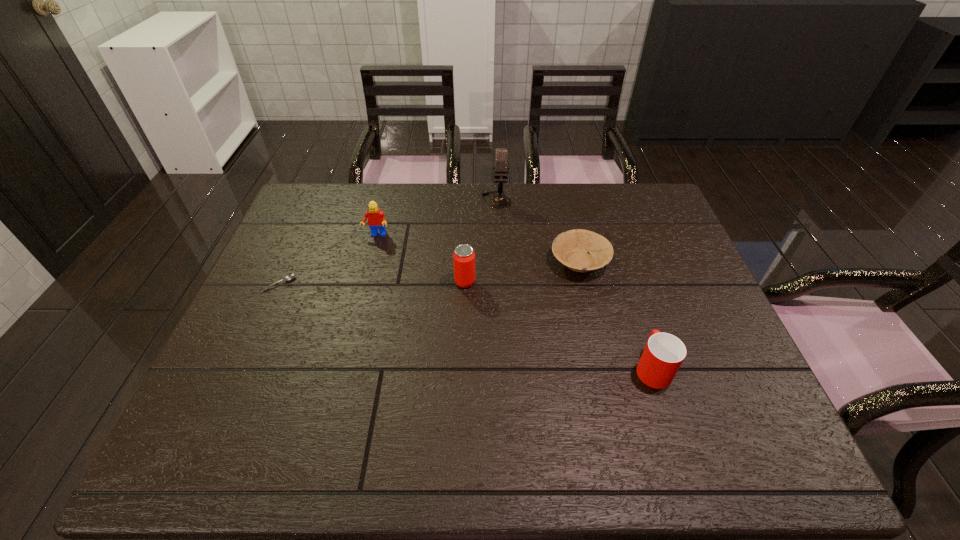
At what (x,y) coordinates should I click in order to perform the action: click on microphone. Please return your answer as a coordinate pair (x, y). Looking at the image, I should click on (499, 201).

You are a GUI agent. You are given a task and a screenshot of the screen. Output one action in this format:
    pyautogui.click(x=<x>, y=<y>)
    Task: Click on the farthest object
    The height and width of the screenshot is (540, 960).
    Given the screenshot: What is the action you would take?
    pyautogui.click(x=499, y=201)

This screenshot has width=960, height=540. Find the location of `Lego`. Lego is located at coordinates (376, 220).

Image resolution: width=960 pixels, height=540 pixels. Identify the location of the second object from left to right. tap(376, 220).

Identify the location of beer can. (464, 257).

Find the location of a particular element. This screenshot has width=960, height=540. the nearest object is located at coordinates (664, 353).

Locate an element on the screen. This screenshot has height=540, width=960. bowl is located at coordinates (571, 248).

Identify the location of the leftmost object. This screenshot has height=540, width=960. tap(291, 276).

Find the location of `soupspoon`. soupspoon is located at coordinates (291, 276).

The image size is (960, 540). Identify the location of vacant area situated 0.380m on the front-facing side of the tallest object. (501, 293).